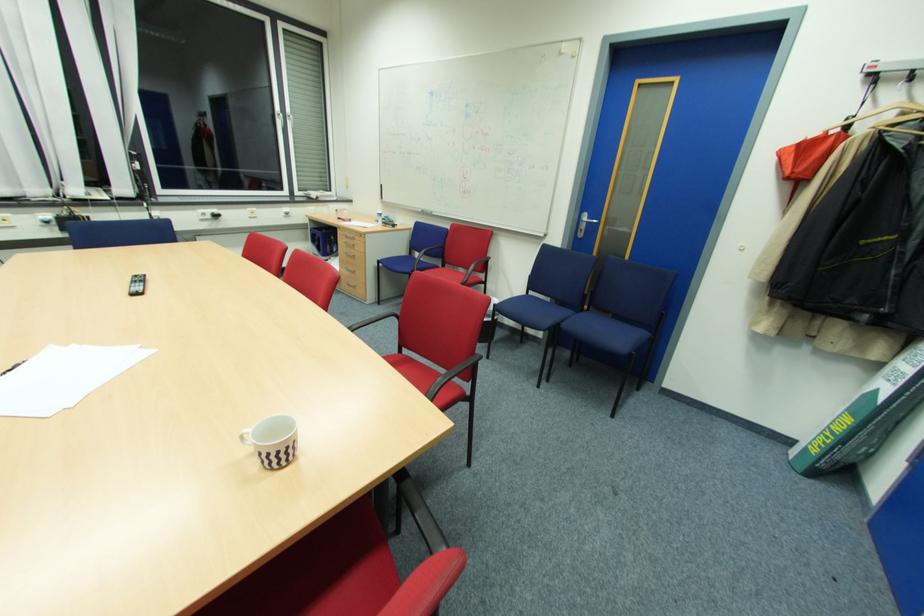
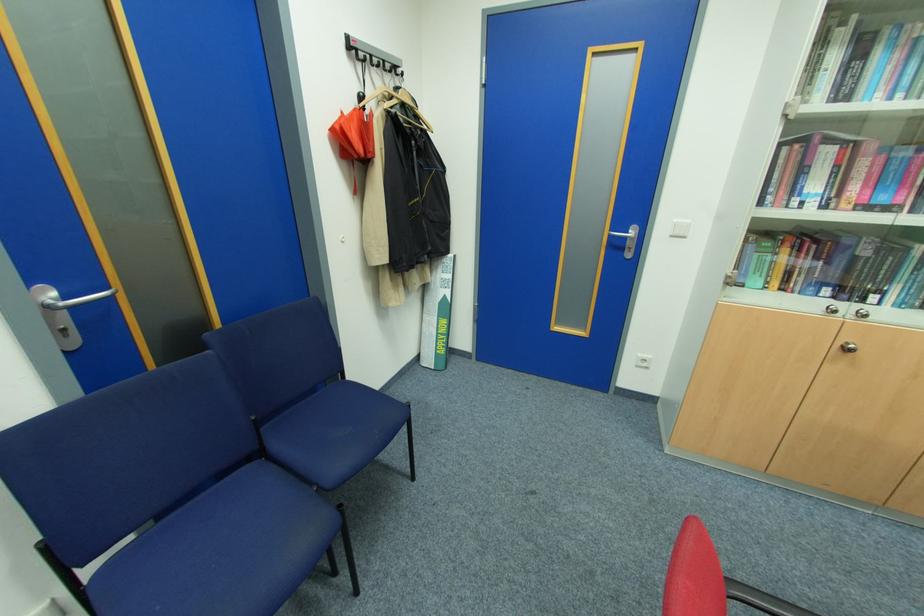
The point at (882, 391) is marked in the first image. Where is the corresponding point in the second image?

(448, 296)